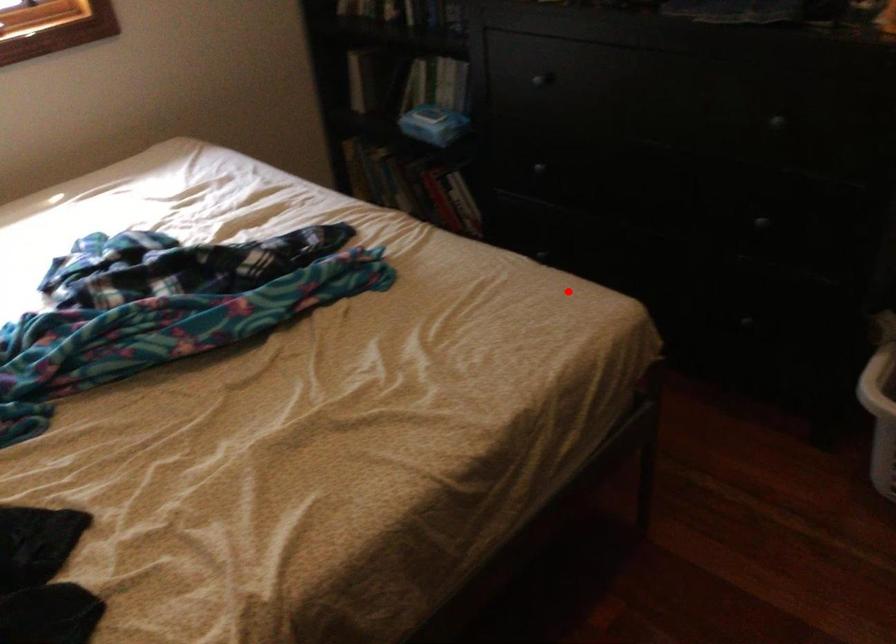
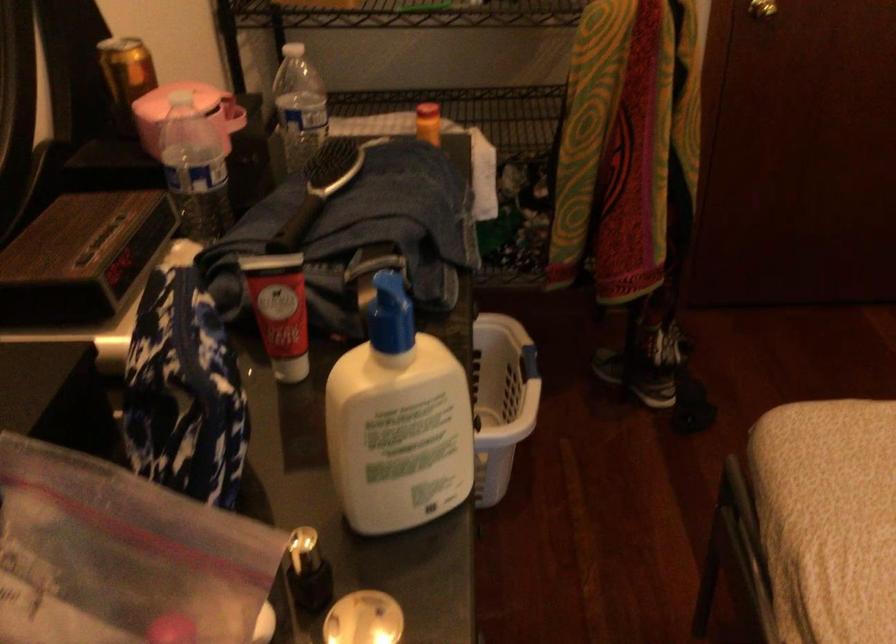
Question: I am providing you with two images of the same scene from different viewpoints. A red point is shown in image1. For the corresponding object point in image2, is it positioned nearer or farther from the camera?

Choices:
 (A) Nearer
 (B) Farther

Answer: (A)